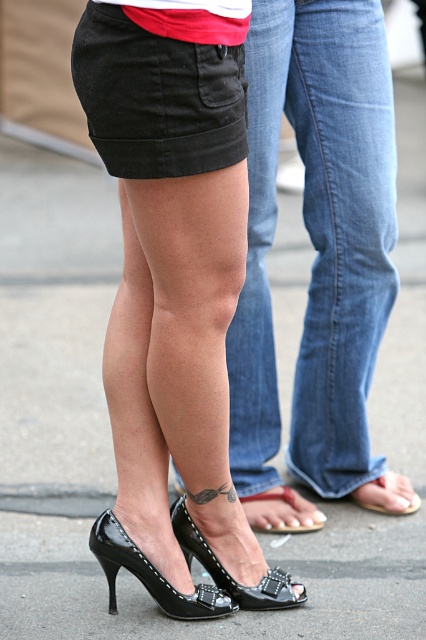
Question: Which point is farther to the camera?

Choices:
 (A) (399, 502)
 (B) (164, 116)

Answer: (A)

Question: Which object is closer to the camera taking this photo?

Choices:
 (A) glossy patent leather high-heeled shoe at lower center
 (B) black patent leather high-heeled shoe at lower center
 (C) black patent leather sandal at lower right

Answer: (B)

Question: Does shiny patent leather heels at lower center appear over black patent leather sandal at lower center?

Choices:
 (A) no
 (B) yes

Answer: (B)

Question: Can you confirm if shiny patent leather heels at lower center is bigger than denim jeans at center?

Choices:
 (A) yes
 (B) no

Answer: (A)

Question: Which point is farther to the camera?

Choices:
 (A) black patent leather sandal at lower center
 (B) black denim skirt at upper center
 (C) glossy patent leather high-heeled shoe at lower center

Answer: (A)

Question: Does denim jeans at center have a greater width compared to black patent leather sandal at lower right?

Choices:
 (A) yes
 (B) no

Answer: (A)